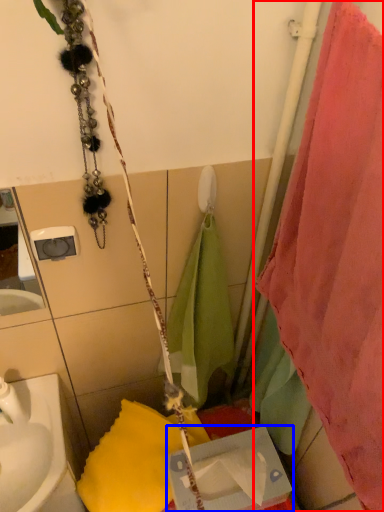
Question: Which point is further to the camera, curtain (highlighted by a red box) or box (highlighted by a blue box)?

Choices:
 (A) curtain
 (B) box

Answer: (B)